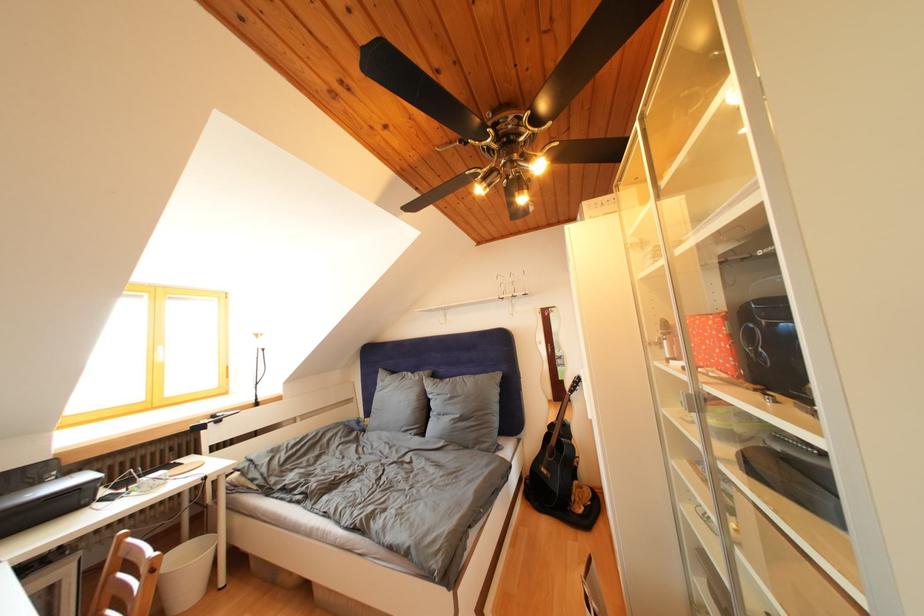
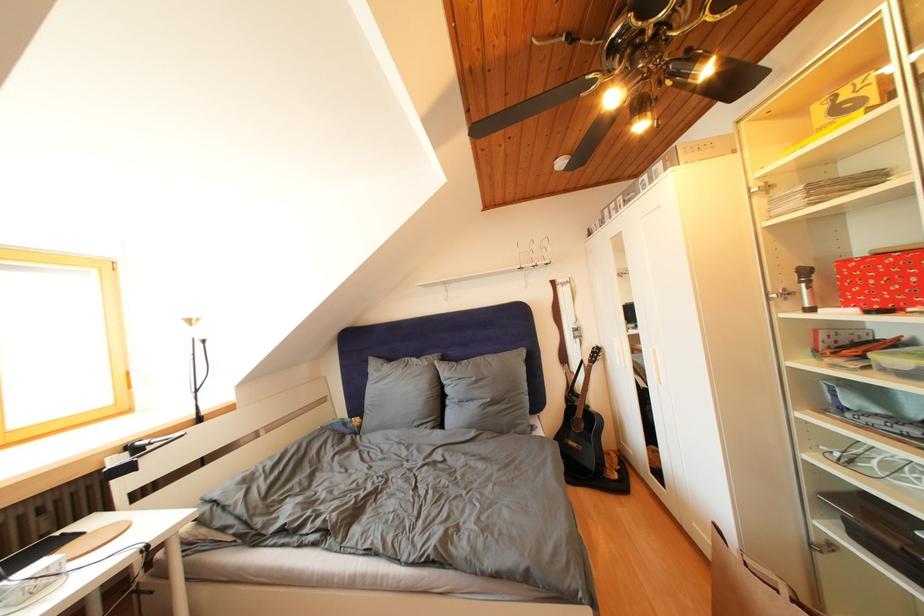
Question: The first image is from the beginning of the video and the second image is from the end. How did the camera likely rotate when shooting the video?

Choices:
 (A) Left
 (B) Right
 (C) Up
 (D) Down

Answer: (B)